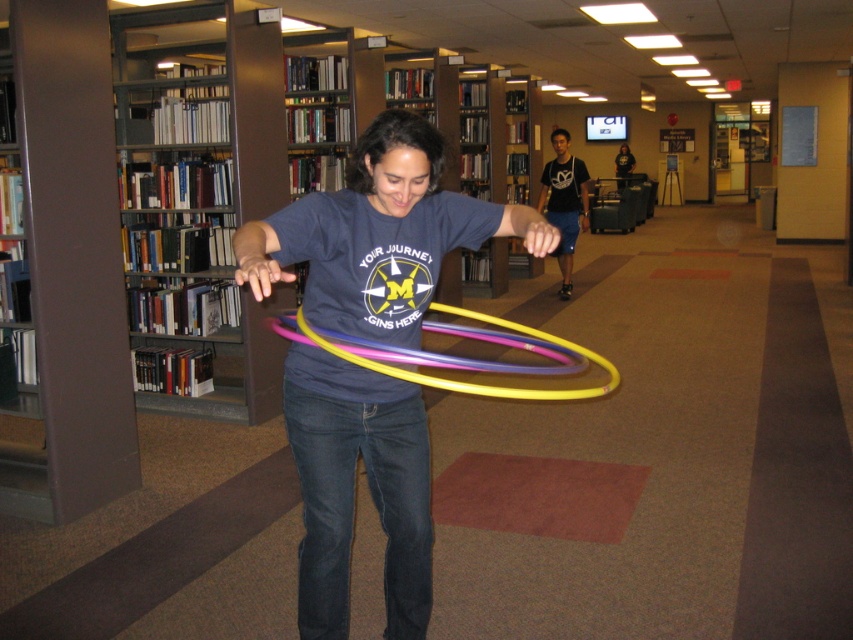
Which of these two, wooden bookshelf at left or multicolored plastic hula hoop at center, stands taller?

wooden bookshelf at left

Does wooden bookshelf at left appear on the left side of multicolored plastic hula hoop at center?

Indeed, wooden bookshelf at left is positioned on the left side of multicolored plastic hula hoop at center.

Image resolution: width=853 pixels, height=640 pixels. Describe the element at coordinates (163, 195) in the screenshot. I see `wooden bookshelf at left` at that location.

Where is `wooden bookshelf at left`? The height and width of the screenshot is (640, 853). wooden bookshelf at left is located at coordinates (163, 195).

Which of these two, wooden bookshelf at left or matte blue t-shirt at center, stands shorter?

matte blue t-shirt at center

Is wooden bookshelf at left shorter than matte blue t-shirt at center?

In fact, wooden bookshelf at left may be taller than matte blue t-shirt at center.

You are a GUI agent. You are given a task and a screenshot of the screen. Output one action in this format:
    pyautogui.click(x=<x>, y=<y>)
    Task: Click on the wooden bookshelf at left
    The image size is (853, 640).
    Given the screenshot: What is the action you would take?
    pyautogui.click(x=163, y=195)

Where is `wooden bookshelf at left`? This screenshot has width=853, height=640. wooden bookshelf at left is located at coordinates (163, 195).

Who is positioned more to the left, matte blue t-shirt at center or multicolored plastic hula hoop at center?

From the viewer's perspective, matte blue t-shirt at center appears more on the left side.

In the scene shown: Does matte blue t-shirt at center appear on the left side of multicolored plastic hula hoop at center?

Indeed, matte blue t-shirt at center is positioned on the left side of multicolored plastic hula hoop at center.

Does point (305, 452) come behind point (498, 365)?

No, it is in front of (498, 365).

The image size is (853, 640). Identify the location of matte blue t-shirt at center. (379, 236).